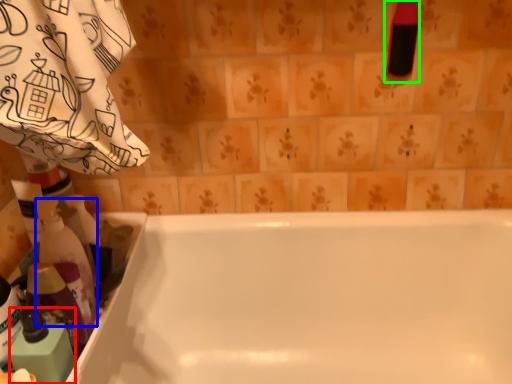
Question: Which is farther away from cleaning product (highlighted by a red box)? cleaning product (highlighted by a blue box) or cleaning product (highlighted by a green box)?

Choices:
 (A) cleaning product
 (B) cleaning product

Answer: (B)